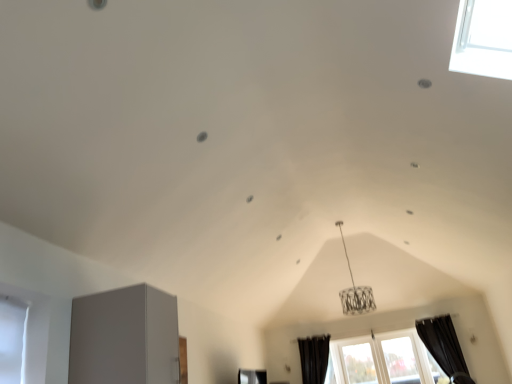
Question: Does black fabric curtain at lower right, the 1th curtain from the right, have a smaller size compared to black fabric curtain at lower center, placed as the 2th curtain when sorted from right to left?

Choices:
 (A) no
 (B) yes

Answer: (A)

Question: Does black fabric curtain at lower right, the 1th curtain from the right, lie behind black fabric curtain at lower center, the 1th curtain when ordered from left to right?

Choices:
 (A) no
 (B) yes

Answer: (A)

Question: From the image's perspective, is black fabric curtain at lower right, the 1th curtain from the right, located above black fabric curtain at lower center, the 1th curtain when ordered from left to right?

Choices:
 (A) no
 (B) yes

Answer: (B)

Question: Is black fabric curtain at lower right, the 1th curtain from the right, not near black fabric curtain at lower center, the 1th curtain when ordered from left to right?

Choices:
 (A) no
 (B) yes

Answer: (B)

Question: Is black fabric curtain at lower center, placed as the 2th curtain when sorted from right to left, at the back of black fabric curtain at lower right, the 2th curtain positioned from the left?

Choices:
 (A) yes
 (B) no

Answer: (B)

Question: Is the position of black fabric curtain at lower right, the 2th curtain positioned from the left, less distant than that of black fabric curtain at lower center, placed as the 2th curtain when sorted from right to left?

Choices:
 (A) no
 (B) yes

Answer: (B)

Question: Considering the relative sizes of black fabric curtain at lower right, the 1th curtain from the right, and white glass window at lower right, which is the first window from left to right, in the image provided, is black fabric curtain at lower right, the 1th curtain from the right, shorter than white glass window at lower right, which is the first window from left to right,?

Choices:
 (A) yes
 (B) no

Answer: (B)

Question: Can you confirm if black fabric curtain at lower right, the 1th curtain from the right, is taller than white glass window at lower right, which is the first window from left to right?

Choices:
 (A) no
 (B) yes

Answer: (B)

Question: Does black fabric curtain at lower right, the 1th curtain from the right, appear on the left side of white glass window at lower right, which is counted as the second window, starting from the right?

Choices:
 (A) no
 (B) yes

Answer: (A)

Question: From a real-world perspective, is black fabric curtain at lower right, the 2th curtain positioned from the left, located higher than white glass window at lower right, which is counted as the second window, starting from the right?

Choices:
 (A) no
 (B) yes

Answer: (B)

Question: Considering the relative sizes of black fabric curtain at lower right, the 1th curtain from the right, and white glass window at lower right, which is the first window from left to right, in the image provided, is black fabric curtain at lower right, the 1th curtain from the right, wider than white glass window at lower right, which is the first window from left to right,?

Choices:
 (A) no
 (B) yes

Answer: (B)

Question: Is black fabric curtain at lower right, the 1th curtain from the right, at the right side of white glass window at lower right, which is the first window from left to right?

Choices:
 (A) yes
 (B) no

Answer: (A)

Question: Can you confirm if white glass window at lower right, which is counted as the second window, starting from the right, is positioned to the right of transparent glass window at lower right, acting as the first window starting from the right?

Choices:
 (A) no
 (B) yes

Answer: (A)